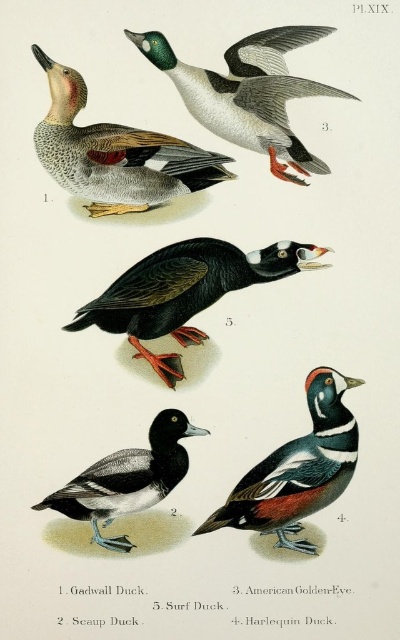
Which duck is taller between the green glossy duck at upper center and the multicolored feathered duck at lower right?

The multicolored feathered duck at lower right is taller than the green glossy duck at upper center.

You are an ornithologist examining Plate XIX from a scientific book. You notice two ducks labeled as matte black duck at upper left and black glossy duck at center. Which duck is closer to the viewer?

The matte black duck at upper left is closer to the viewer because it is positioned in front of the black glossy duck at center.

Based on the photo, you are an ornithologist examining Plate XIX from a scientific book. You notice two ducks labeled as matte black duck at upper left and black glossy duck at center. Based on their positions and the information provided, which duck is taller?

The matte black duck at upper left is taller than the black glossy duck at center.